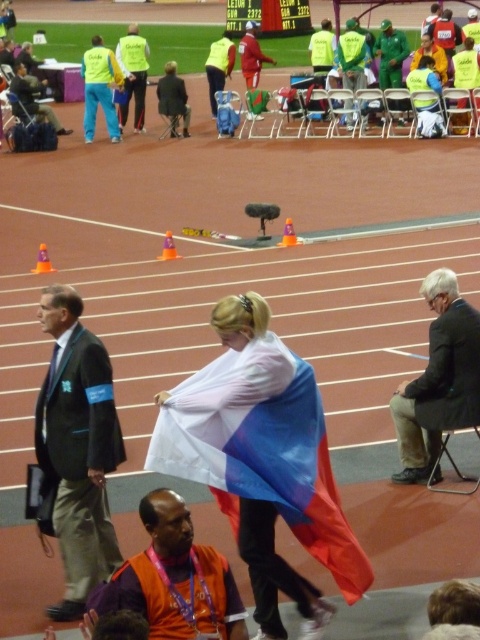
You are an event organizer who needs to ensure that the polyester flag at center and the dark gray suit at center are visible to the audience. Given that the audience is seated behind the seated man on the right side, which object will be more visible to them?

The polyester flag at center will be more visible to the audience because it has a larger size compared to the dark gray suit at center.

You are standing at the point marked as point (72, 490) and want to take a photo of the flag bearer walking across the track. The camera you have can focus on subjects up to 6 meters away. Will the camera be able to capture a clear photo of the flag bearer?

The distance between point (72, 490) and the camera is 6.39 meters. Since the camera can focus up to 6 meters, the distance is slightly beyond its range, so it might not capture a clear photo.